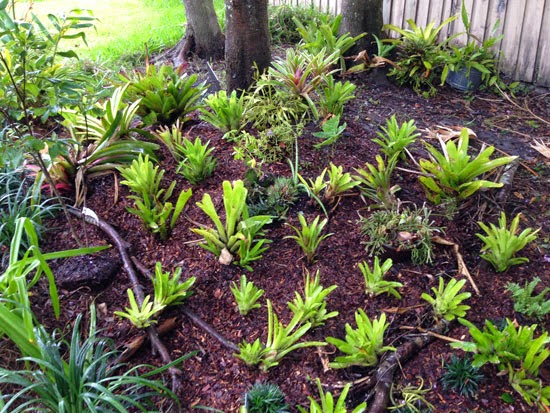
The width and height of the screenshot is (550, 413). I want to click on plants cactus, so click(301, 69), click(53, 166).